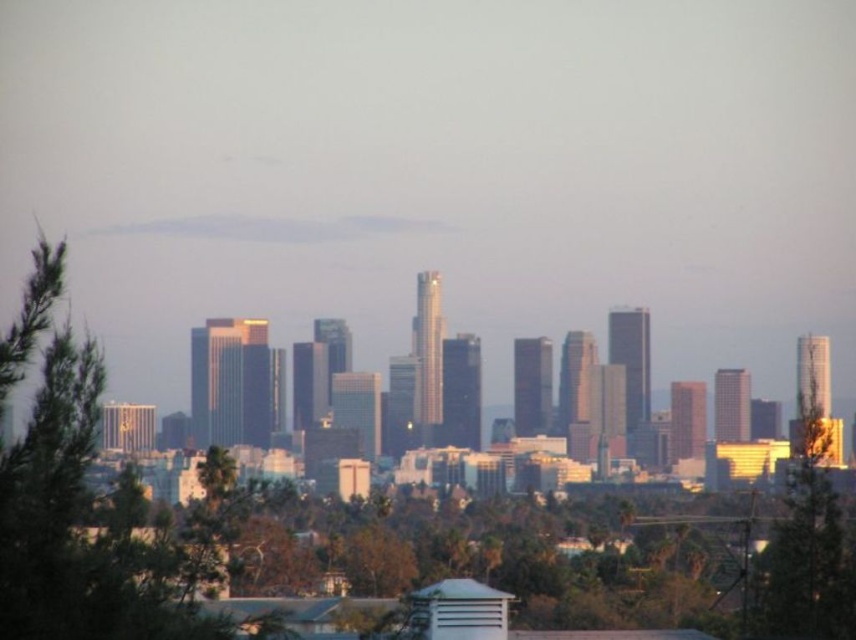
Who is more forward, [72,540] or [839,618]?

Positioned in front is point [72,540].

Is point (158, 561) less distant than point (803, 552)?

Yes, point (158, 561) is closer to viewer.

You are a GUI agent. You are given a task and a screenshot of the screen. Output one action in this format:
    pyautogui.click(x=<x>, y=<y>)
    Task: Click on the green leafy tree at left
    This screenshot has width=856, height=640.
    Given the screenshot: What is the action you would take?
    pyautogui.click(x=76, y=525)